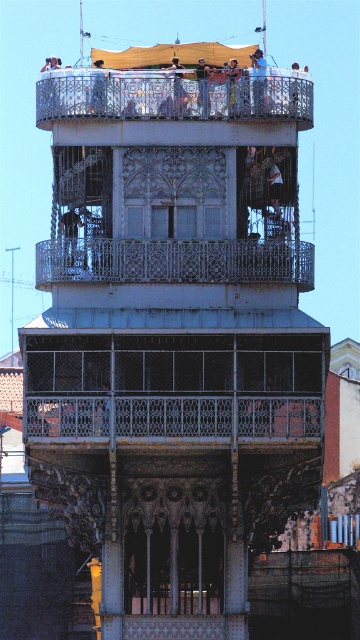
You are a maintenance worker needing to move a 50 feet long ladder from the metallic silver balcony at center to the light brown wooden bench at upper center. Can you safely transport it without tilting the ladder vertically?

The distance between the metallic silver balcony at center and the light brown wooden bench at upper center is 49.31 feet. Since the ladder is 50 feet long, it cannot be moved horizontally between them without tilting vertically because the horizontal space is shorter than the ladder length.

You are an architect evaluating the structural integrity of the building. You need to determine which balcony, the silver metallic balcony at upper center or the white wrought iron balcony at center, can support more weight based on their height. Which one would you recommend?

The silver metallic balcony at upper center has a greater height compared to the white wrought iron balcony at center, so it can support more weight due to its structural design.